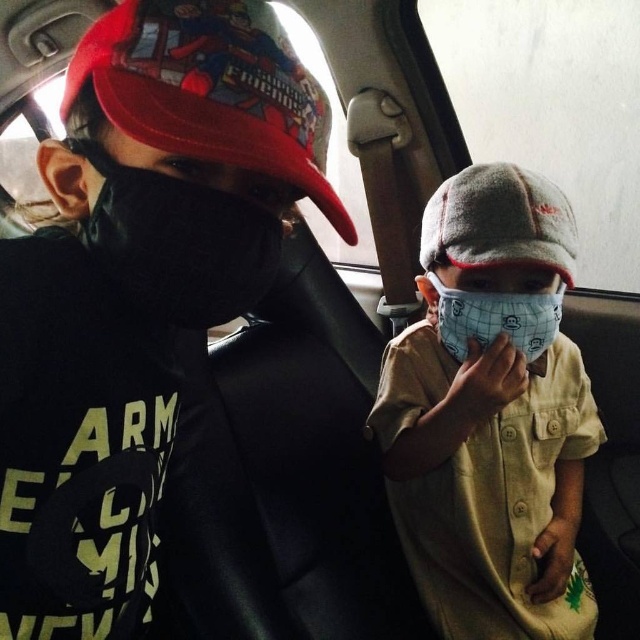
You are a photographer trying to capture a closeup of the white fabric mask at center in the image. The camera you are using has a focus point at coordinate point (490,417). Will this focus point align with the mask?

Yes, the white fabric mask at center is located at point 0.657, 0.767, so the focus point at (490,417) will align with it.

Where is the white fabric mask at center located in the image?

The white fabric mask at center is located at point 0.653 on the x axis and 0.767 on the y axis.

From the picture: You are a healthcare worker checking masks in a car. The black matte mask at left and white mesh mask at center are both present. Which mask is taller?

The black matte mask at left is much taller than the white mesh mask at center.